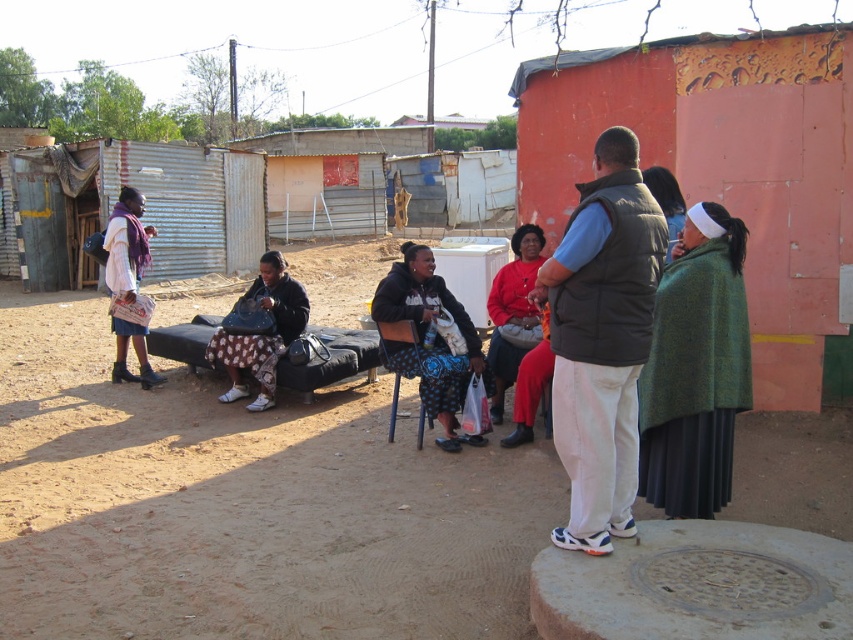
Question: Which of the following is the closest to the observer?

Choices:
 (A) (662, 458)
 (B) (524, 525)
 (C) (766, 216)
 (D) (376, 305)

Answer: (A)

Question: Does dull black fabric bag at center have a smaller size compared to matte purple scarf at left?

Choices:
 (A) no
 (B) yes

Answer: (A)

Question: Is the position of matte black jacket at center less distant than that of dull black fabric bag at center?

Choices:
 (A) no
 (B) yes

Answer: (B)

Question: Does brown dirt field at center come in front of green woolen shawl at center?

Choices:
 (A) yes
 (B) no

Answer: (A)

Question: Considering the real-world distances, which object is farthest from the green woolen shawl at right?

Choices:
 (A) dark gray vest at center
 (B) orange corrugated metal hut at right
 (C) green woolen shawl at center

Answer: (B)

Question: Which point is closer to the camera?

Choices:
 (A) orange corrugated metal hut at right
 (B) dark gray vest at center
 (C) brown dirt field at center

Answer: (C)